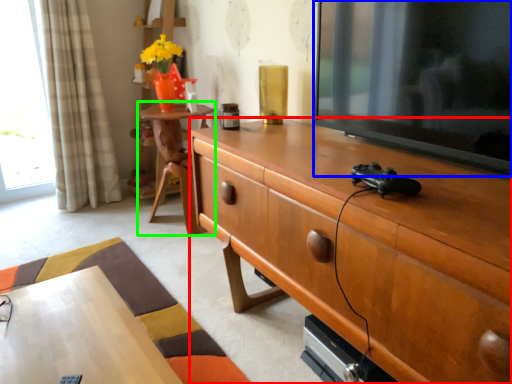
Question: Which is nearer to the cabinetry (highlighted by a red box)? television (highlighted by a blue box) or table (highlighted by a green box).

Choices:
 (A) television
 (B) table

Answer: (A)